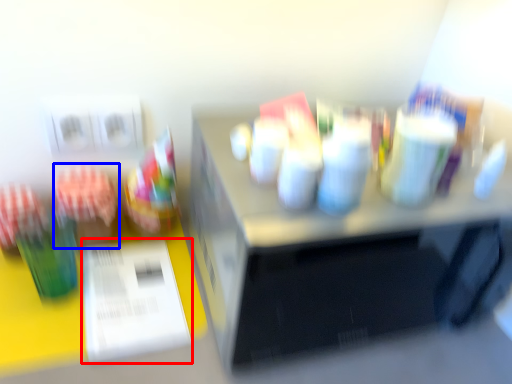
Question: Among these objects, which one is farthest to the camera, paper (highlighted by a red box) or stationery (highlighted by a blue box)?

Choices:
 (A) paper
 (B) stationery

Answer: (B)